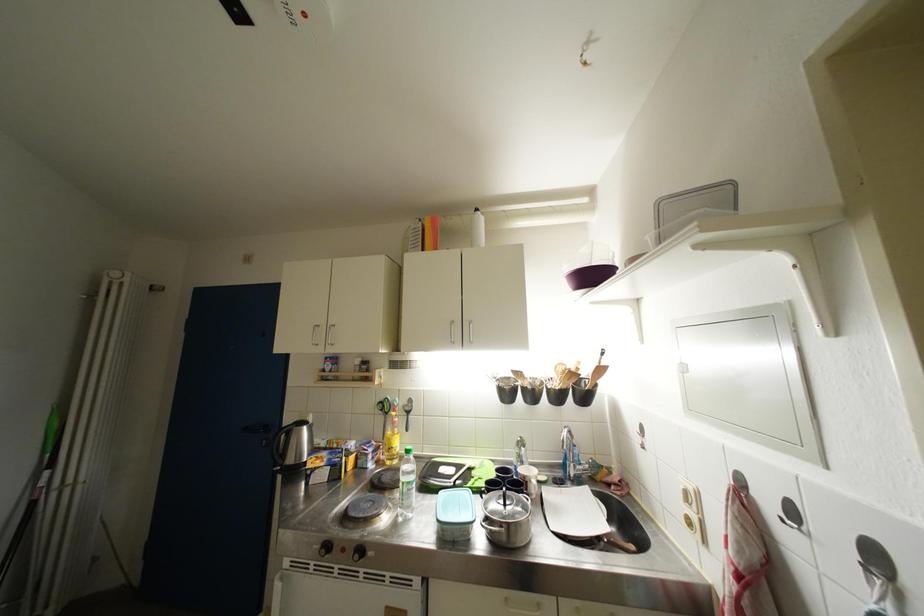
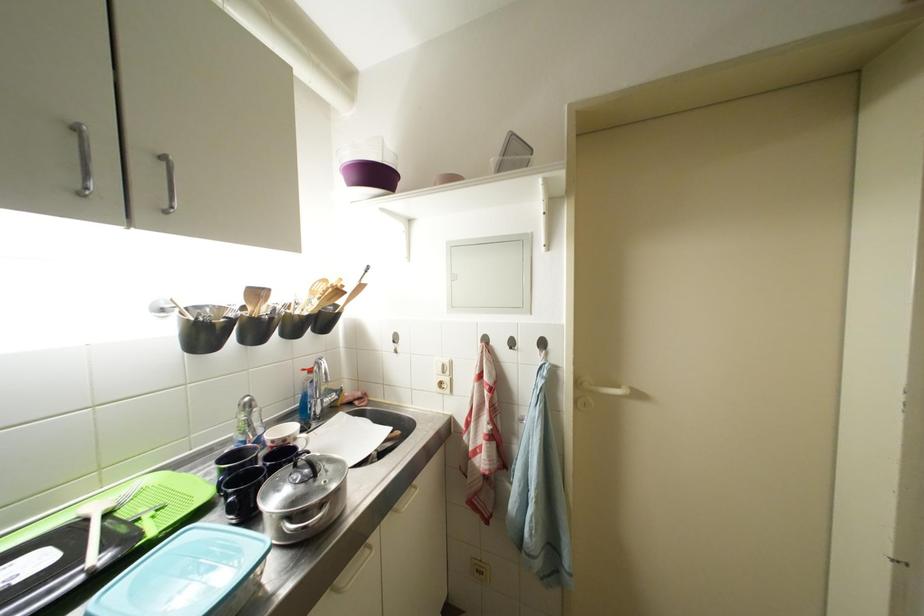
Question: The first image is from the beginning of the video and the second image is from the end. How did the camera likely rotate when shooting the video?

Choices:
 (A) Left
 (B) Right
 (C) Up
 (D) Down

Answer: (B)